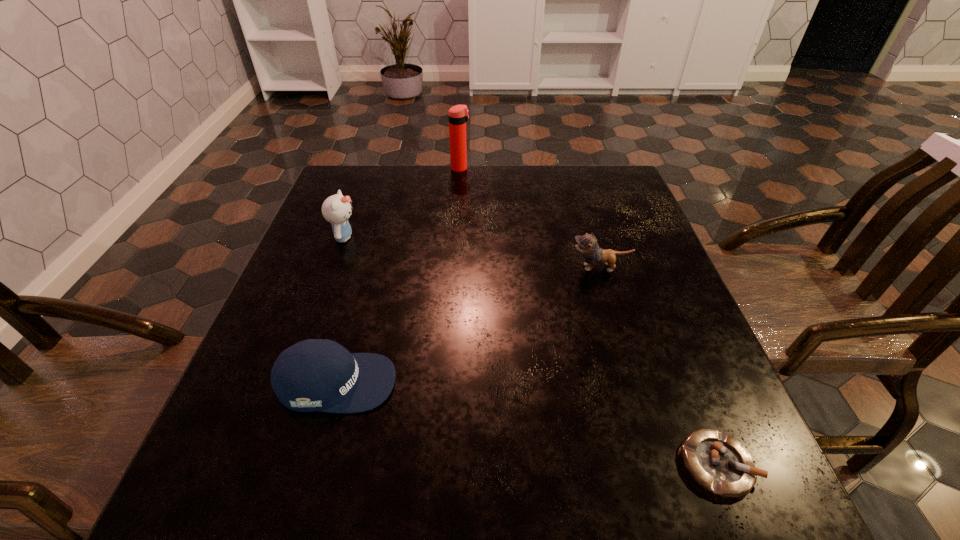
Identify which object is located as the second nearest to the farthest object. Please provide its 2D coordinates. Your answer should be formatted as a tuple, i.e. [(x, y)], where the tuple contains the x and y coordinates of a point satisfying the conditions above.

[(587, 244)]

The image size is (960, 540). I want to click on vacant point that satisfies the following two spatial constraints: 1. on the front side of the farthest object; 2. on the front-facing side of the fourth farthest object, so click(446, 382).

Find the location of a particular element. The image size is (960, 540). vacant space that satisfies the following two spatial constraints: 1. on the front side of the third object from right to left; 2. on the front-facing side of the fourth nearest object is located at coordinates (456, 237).

Identify the location of blank space that satisfies the following two spatial constraints: 1. on the front-facing side of the shortest object; 2. on the right side of the third farthest object. The width and height of the screenshot is (960, 540). (659, 464).

The width and height of the screenshot is (960, 540). I want to click on free spot that satisfies the following two spatial constraints: 1. on the front-facing side of the shortest object; 2. on the right side of the right kitten, so click(659, 464).

The width and height of the screenshot is (960, 540). Find the location of `blank space that satisfies the following two spatial constraints: 1. on the front-facing side of the nearest object; 2. on the left side of the nearer kitten`. blank space that satisfies the following two spatial constraints: 1. on the front-facing side of the nearest object; 2. on the left side of the nearer kitten is located at coordinates (659, 464).